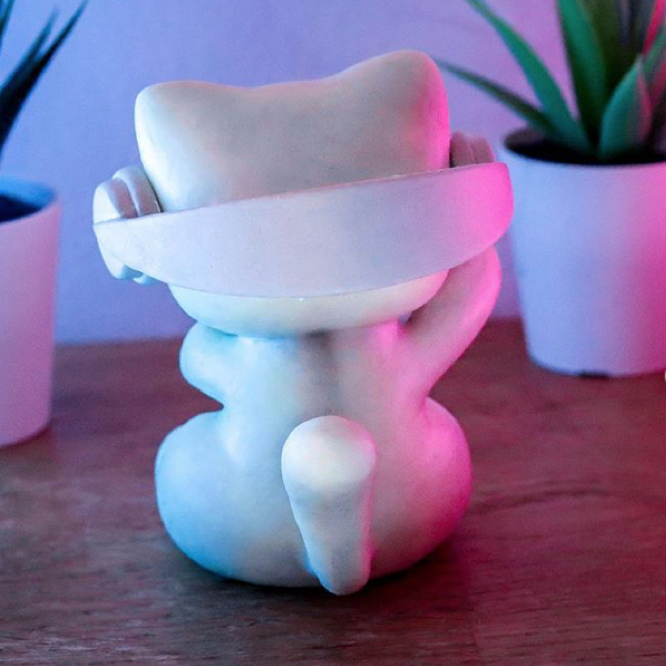
Image resolution: width=666 pixels, height=666 pixels. Identify the location of succulent. point(14,86), point(593,133).